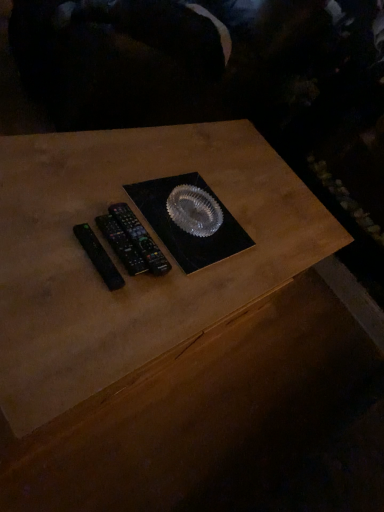
This screenshot has width=384, height=512. I want to click on vacant space in front of black plastic remote at left, the second control from the back, so click(x=71, y=302).